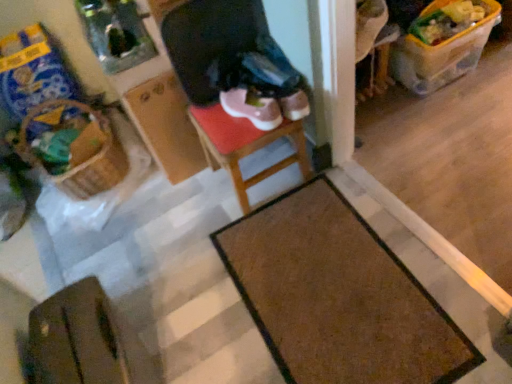
Question: Is brown woven basket at left wider or thinner than wooden stool at center?

Choices:
 (A) wide
 (B) thin

Answer: (A)

Question: From their relative heights in the image, would you say brown woven basket at left is taller or shorter than wooden stool at center?

Choices:
 (A) short
 (B) tall

Answer: (A)

Question: Based on their relative distances, which object is farther from the brown leather wallet at lower left?

Choices:
 (A) wooden stool at center
 (B) brown textured mat at lower center
 (C) brown woven basket at left
 (D) pink suede sneakers at center

Answer: (D)

Question: Estimate the real-world distances between objects in this image. Which object is farther from the brown textured mat at lower center?

Choices:
 (A) brown woven basket at left
 (B) wooden stool at center
 (C) brown leather wallet at lower left
 (D) pink suede sneakers at center

Answer: (A)